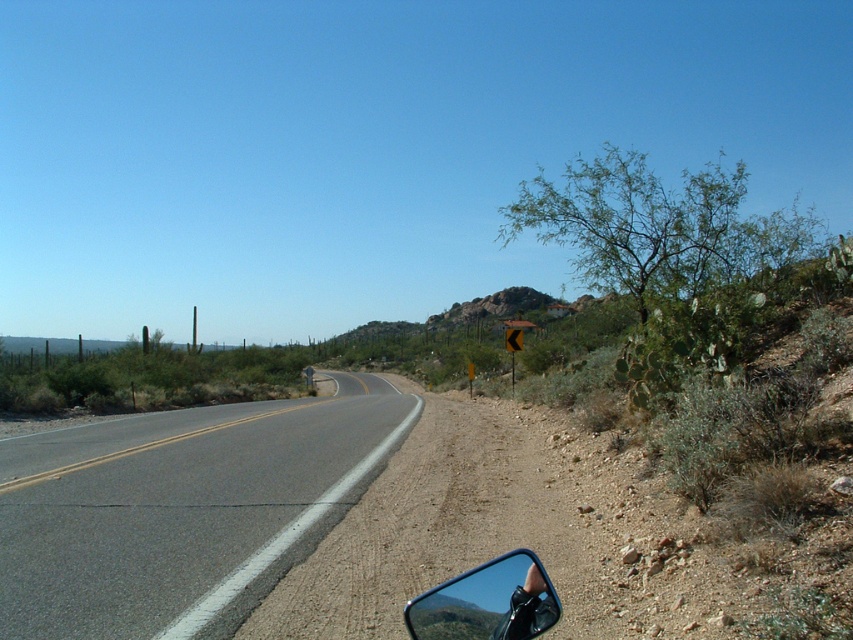
You are a hiker trying to navigate the desert road. You see two points marked on the road ahead. Which point is closer to you, point (68, 636) or point (418, 424)?

Point (68, 636) is closer to the viewer than point (418, 424).

You are a driver approaching the dirt road at lower left and the black rubber view mirror at lower right. Which object appears higher in the image?

The dirt road at lower left appears higher than the black rubber view mirror at lower right.

You are driving a car with a long trailer attached. You need to navigate through the asphalt road at left and avoid hitting the black rubber view mirror at lower right. Can you estimate which object takes up more space in the image?

The asphalt road at left is bigger than the black rubber view mirror at lower right, so the asphalt road at left takes up more space in the image.